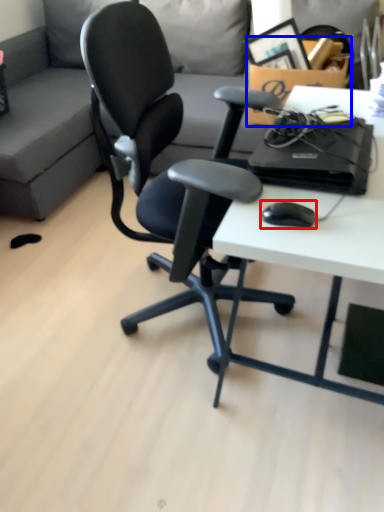
Question: Which of the following is the closest to the observer, mouse (highlighted by a red box) or cardboard box (highlighted by a blue box)?

Choices:
 (A) mouse
 (B) cardboard box

Answer: (A)